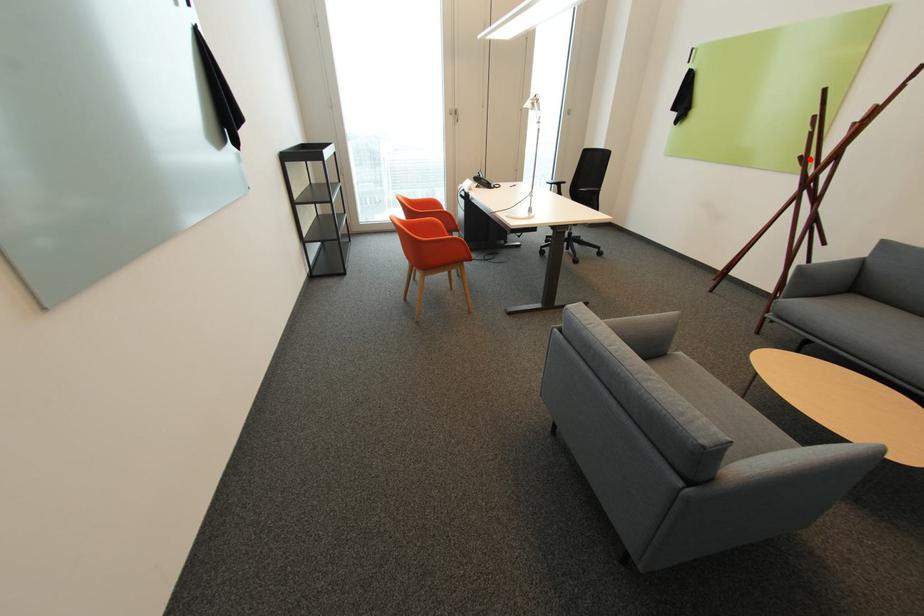
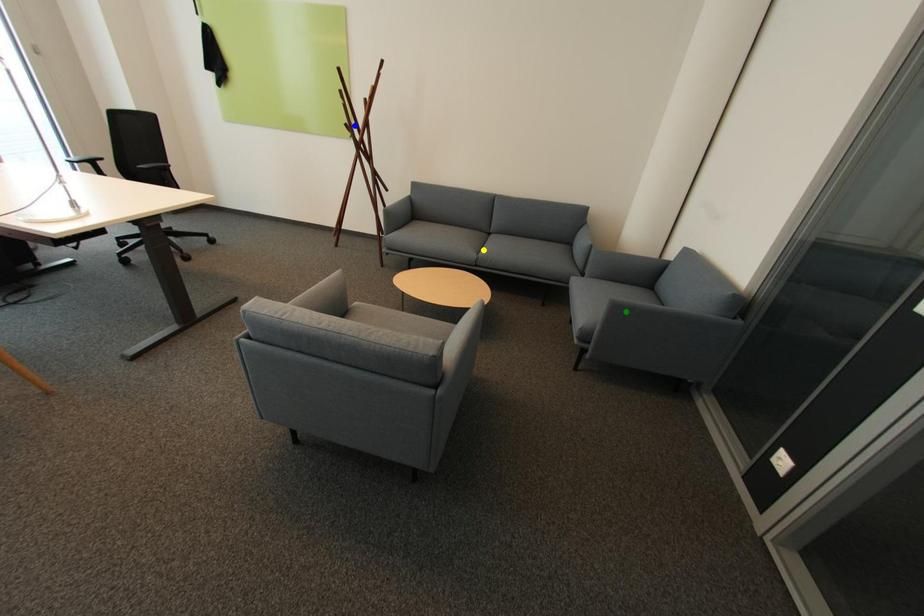
Question: I am providing you with two images of the same scene from different viewpoints. A red point is marked on the first image. You are given multiple points on the second image. Can you choose the point in image 2 that corresponds to the point in image 1?

Choices:
 (A) yellow point
 (B) blue point
 (C) green point

Answer: (B)